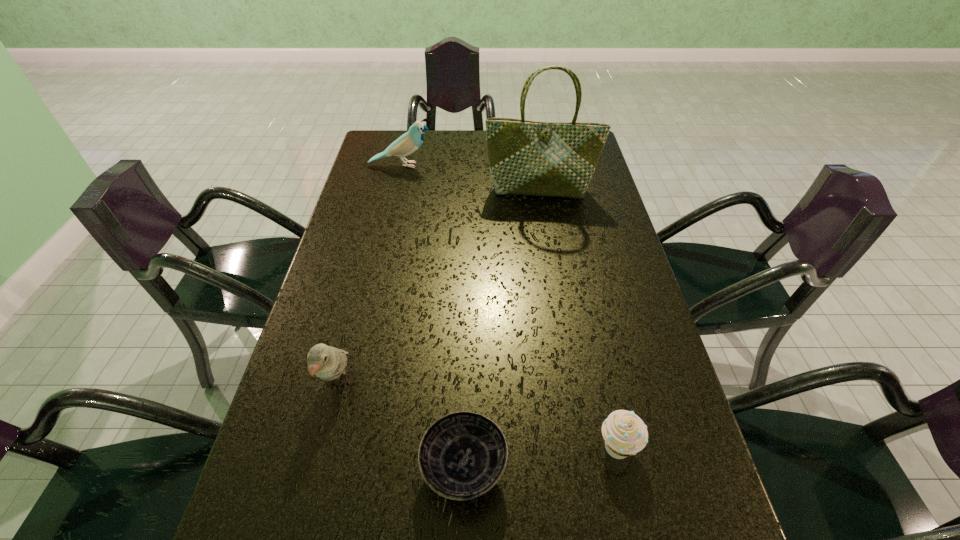
The image size is (960, 540). Identify the location of object that stands as the third closest to the nearer bird. (525, 157).

The image size is (960, 540). Identify the location of free space that satisfies the following two spatial constraints: 1. at the face of the fourth tallest object; 2. on the left side of the third nearest object. (323, 448).

At what (x,y) coordinates should I click in order to perform the action: click on vacant space that satisfies the following two spatial constraints: 1. on the back side of the muffin; 2. at the face of the farther bird. Please return your answer as a coordinate pair (x, y). This screenshot has width=960, height=540. Looking at the image, I should click on (555, 165).

This screenshot has height=540, width=960. Find the location of `vacant area in the image that satisfies the following two spatial constraints: 1. at the face of the third farthest object; 2. on the right side of the bowl`. vacant area in the image that satisfies the following two spatial constraints: 1. at the face of the third farthest object; 2. on the right side of the bowl is located at coordinates (318, 468).

This screenshot has width=960, height=540. Find the location of `vacant space that satisfies the following two spatial constraints: 1. at the face of the nearer bird; 2. on the right side of the bowl`. vacant space that satisfies the following two spatial constraints: 1. at the face of the nearer bird; 2. on the right side of the bowl is located at coordinates (318, 468).

You are a GUI agent. You are given a task and a screenshot of the screen. Output one action in this format:
    pyautogui.click(x=<x>, y=<y>)
    Task: Click on the vacant region that satisfies the following two spatial constraints: 1. at the face of the farther bird; 2. on the right side of the bowl
    The image size is (960, 540).
    Given the screenshot: What is the action you would take?
    pyautogui.click(x=333, y=468)

You are a GUI agent. You are given a task and a screenshot of the screen. Output one action in this format:
    pyautogui.click(x=<x>, y=<y>)
    Task: Click on the vacant area that satisfies the following two spatial constraints: 1. at the face of the shopping bag; 2. on the left side of the farther bird
    
    Given the screenshot: What is the action you would take?
    pyautogui.click(x=396, y=191)

The width and height of the screenshot is (960, 540). I want to click on free spot that satisfies the following two spatial constraints: 1. at the face of the farther bird; 2. on the left side of the bowl, so click(x=333, y=468).

Image resolution: width=960 pixels, height=540 pixels. Find the location of `free spot that satisfies the following two spatial constraints: 1. at the face of the muffin; 2. on the left side of the nearer bird`. free spot that satisfies the following two spatial constraints: 1. at the face of the muffin; 2. on the left side of the nearer bird is located at coordinates (323, 448).